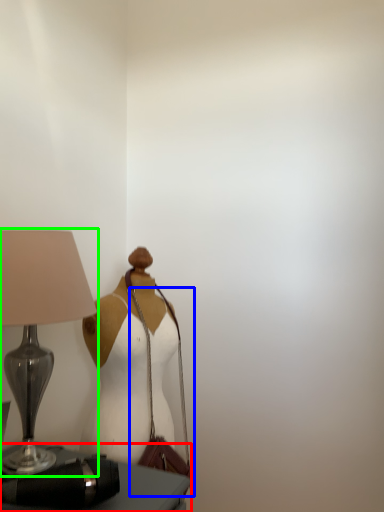
Question: Which object is the closest to the furniture (highlighted by a red box)? Choose among these: shoulder bag (highlighted by a blue box) or lamp (highlighted by a green box).

Choices:
 (A) shoulder bag
 (B) lamp

Answer: (A)